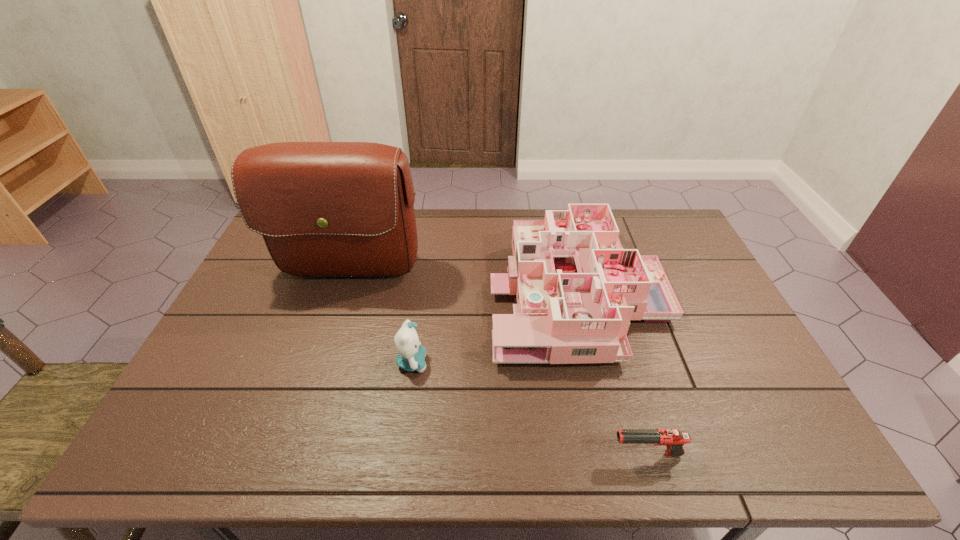
Identify which object is the second closest to the dollhouse. Please provide its 2D coordinates. Your answer should be formatted as a tuple, i.e. [(x, y)], where the tuple contains the x and y coordinates of a point satisfying the conditions above.

[(674, 440)]